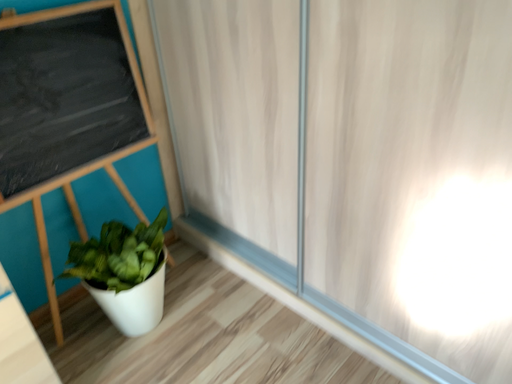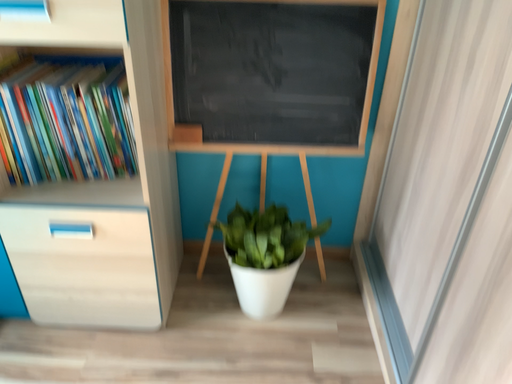
Question: How did the camera likely rotate when shooting the video?

Choices:
 (A) rotated left
 (B) rotated right

Answer: (A)